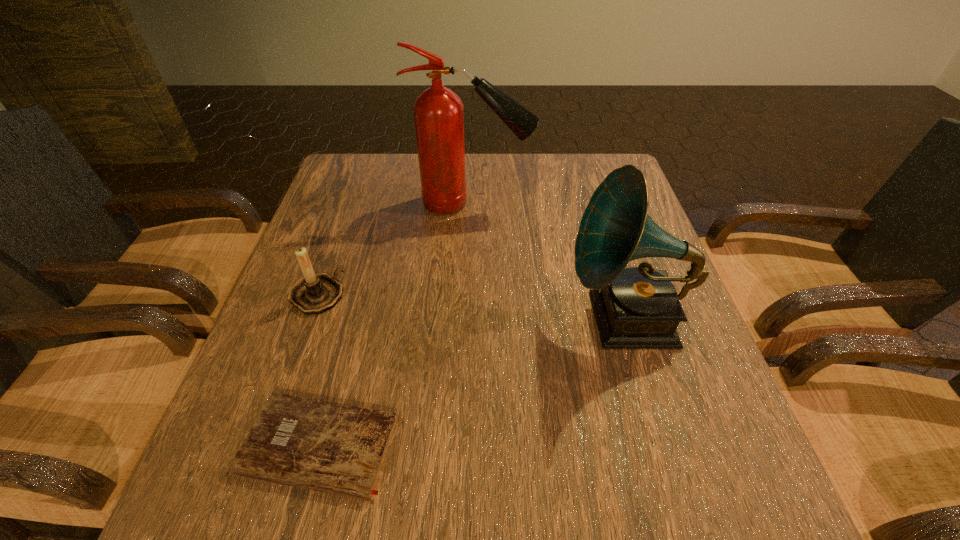
Image resolution: width=960 pixels, height=540 pixels. In order to click on free space between the candle holder and the tallest object in this screenshot , I will do `click(395, 249)`.

Find the location of a particular element. The image size is (960, 540). free space between the third tallest object and the Bible is located at coordinates (318, 370).

This screenshot has width=960, height=540. What are the coordinates of `vacant space that's between the tallest object and the rightmost object` in the screenshot? It's located at (549, 261).

Locate an element on the screen. The height and width of the screenshot is (540, 960). empty location between the phonograph_record and the tallest object is located at coordinates (549, 261).

Where is `blank region between the tallest object and the Bible`? blank region between the tallest object and the Bible is located at coordinates (396, 324).

You are a GUI agent. You are given a task and a screenshot of the screen. Output one action in this format:
    pyautogui.click(x=<x>, y=<y>)
    Task: Click on the empty space that is in between the rightmost object and the third tallest object
    This screenshot has width=960, height=540.
    Given the screenshot: What is the action you would take?
    pyautogui.click(x=471, y=307)

Locate which object is the closest to the third tallest object. Please provide its 2D coordinates. Your answer should be formatted as a tuple, i.e. [(x, y)], where the tuple contains the x and y coordinates of a point satisfying the conditions above.

[(339, 449)]

Identify which object is the second closest to the second tallest object. Please provide its 2D coordinates. Your answer should be formatted as a tuple, i.e. [(x, y)], where the tuple contains the x and y coordinates of a point satisfying the conditions above.

[(339, 449)]

Where is `vacant region that satisfies the following two spatial constraints: 1. at the nozzle end of the fire extinguisher; 2. on the front side of the third tallest object`? This screenshot has width=960, height=540. vacant region that satisfies the following two spatial constraints: 1. at the nozzle end of the fire extinguisher; 2. on the front side of the third tallest object is located at coordinates [470, 295].